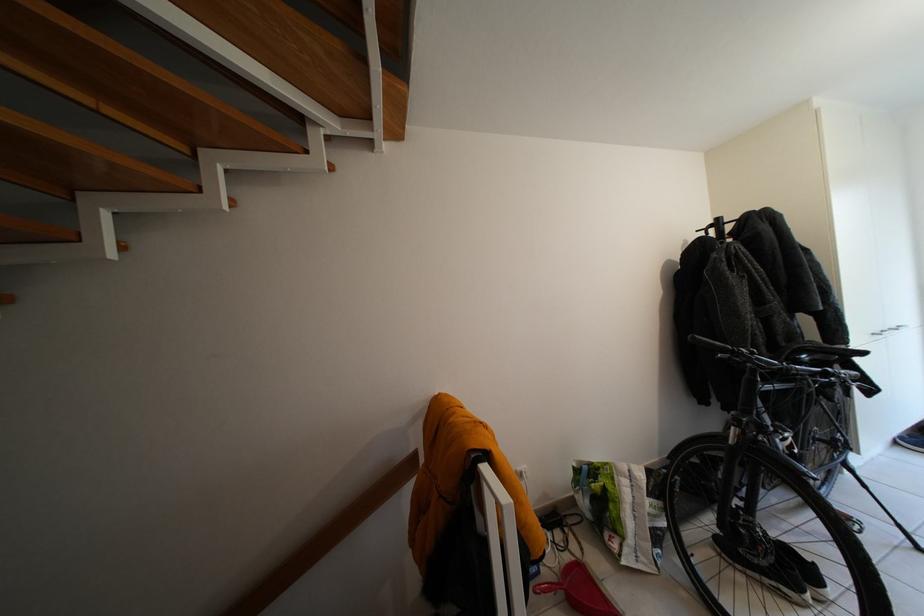
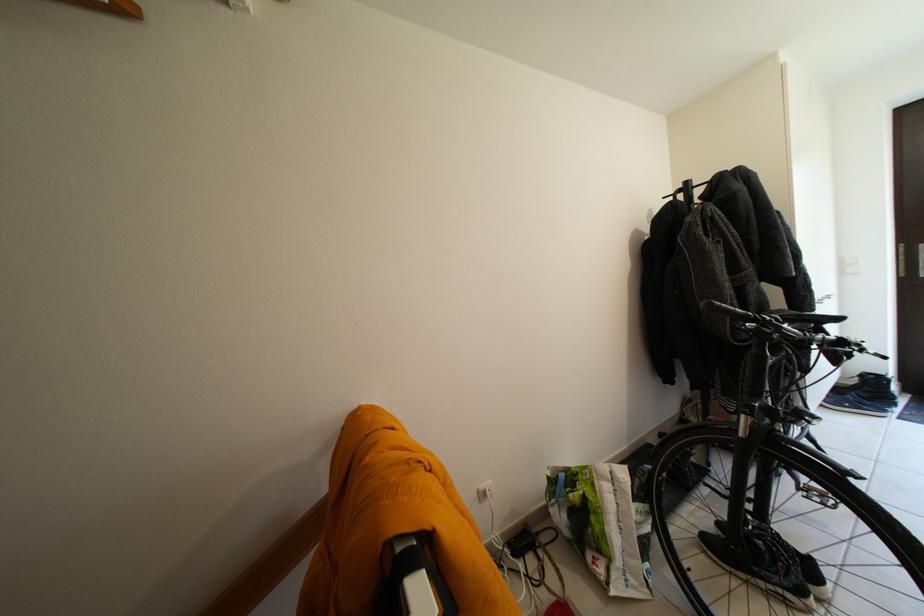
Where in the second image is the point corresponding to [726,225] from the first image?

(696, 188)